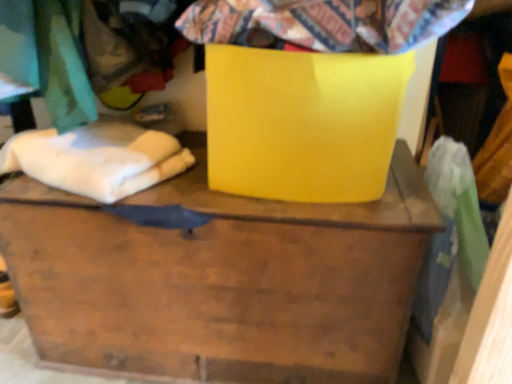
Question: Does glossy yellow cardboard box at center have a greater width compared to matte yellow container at center?

Choices:
 (A) no
 (B) yes

Answer: (A)

Question: From the image's perspective, is glossy yellow cardboard box at center located beneath matte yellow container at center?

Choices:
 (A) yes
 (B) no

Answer: (B)

Question: Does glossy yellow cardboard box at center have a lesser height compared to matte yellow container at center?

Choices:
 (A) no
 (B) yes

Answer: (B)

Question: Is matte yellow container at center located within glossy yellow cardboard box at center?

Choices:
 (A) yes
 (B) no

Answer: (B)

Question: Does glossy yellow cardboard box at center appear on the left side of matte yellow container at center?

Choices:
 (A) no
 (B) yes

Answer: (A)

Question: From the image's perspective, is glossy yellow cardboard box at center on matte yellow container at center?

Choices:
 (A) yes
 (B) no

Answer: (A)

Question: From a real-world perspective, is matte yellow container at center below flannel fabric at upper center?

Choices:
 (A) no
 (B) yes

Answer: (B)

Question: Can you see matte yellow container at center touching flannel fabric at upper center?

Choices:
 (A) no
 (B) yes

Answer: (A)

Question: From a real-world perspective, is matte yellow container at center on flannel fabric at upper center?

Choices:
 (A) yes
 (B) no

Answer: (B)

Question: Would you say flannel fabric at upper center is part of matte yellow container at center's contents?

Choices:
 (A) no
 (B) yes

Answer: (A)

Question: Is matte yellow container at center oriented away from flannel fabric at upper center?

Choices:
 (A) yes
 (B) no

Answer: (B)

Question: Does matte yellow container at center come behind flannel fabric at upper center?

Choices:
 (A) yes
 (B) no

Answer: (A)

Question: Does white soft cloth at left come behind matte yellow container at center?

Choices:
 (A) yes
 (B) no

Answer: (A)